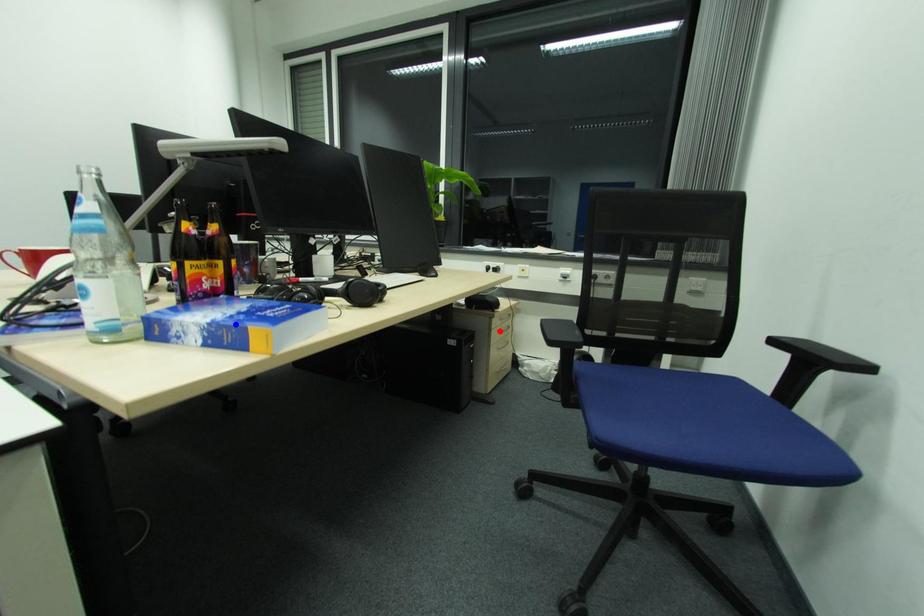
Question: Which of the two points in the image is closer to the camera?

Choices:
 (A) Blue point is closer.
 (B) Red point is closer.

Answer: (A)